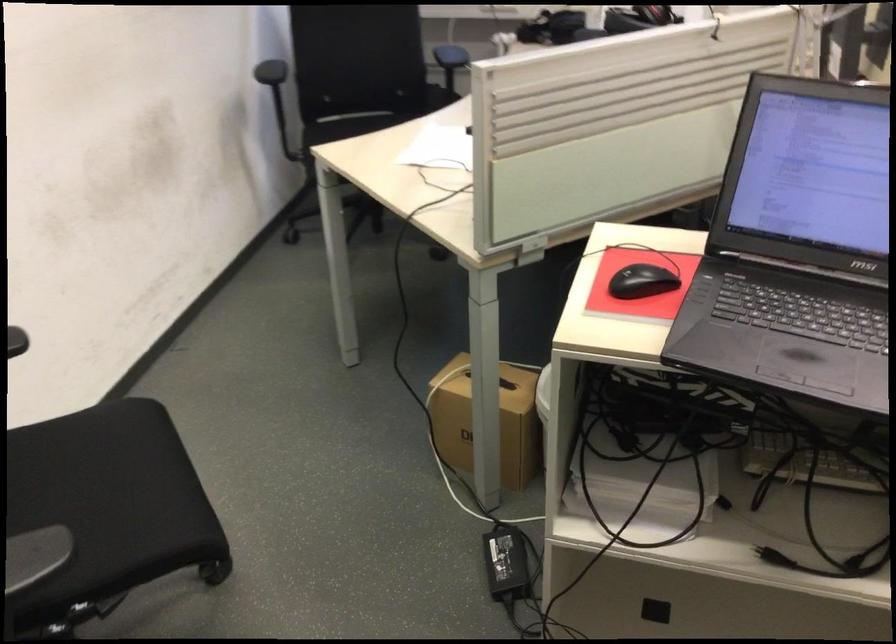
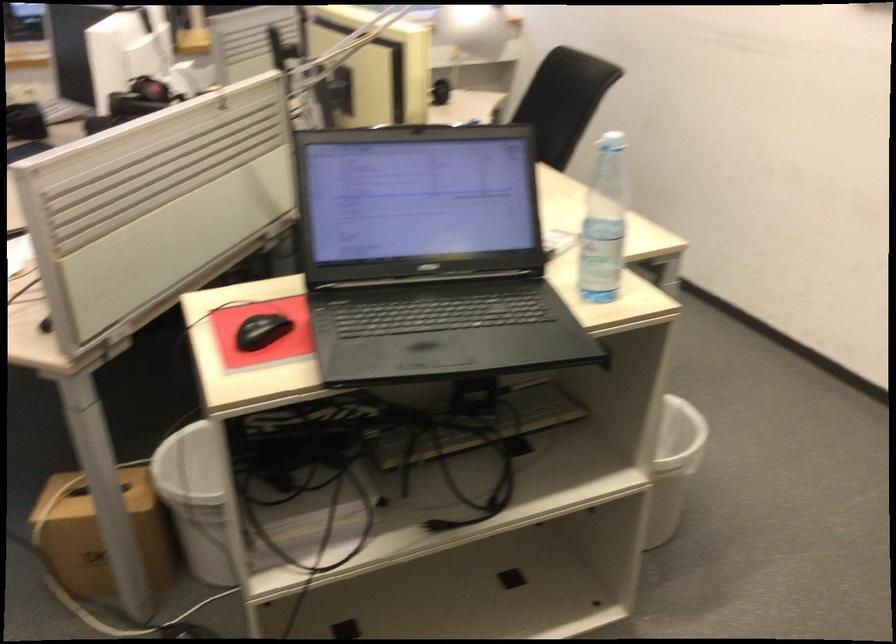
Where in the second image is the point corresponding to pixel 642 278 from the first image?

(261, 330)